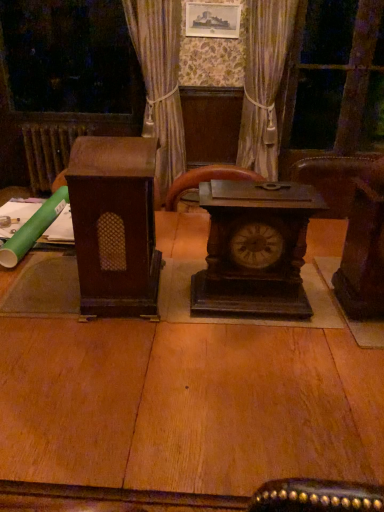
You are a GUI agent. You are given a task and a screenshot of the screen. Output one action in this format:
    pyautogui.click(x=<x>, y=<y>)
    Task: Click on the vacant space in front of dark brown wood clock at center
    This screenshot has height=512, width=384.
    Given the screenshot: What is the action you would take?
    pyautogui.click(x=263, y=350)